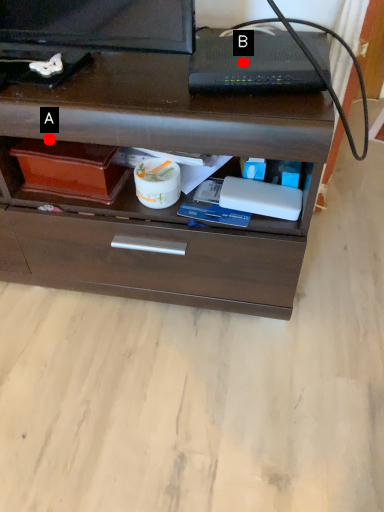
Question: Two points are circled on the image, labeled by A and B beside each circle. Which point is farther to the camera?

Choices:
 (A) A is further
 (B) B is further

Answer: (A)